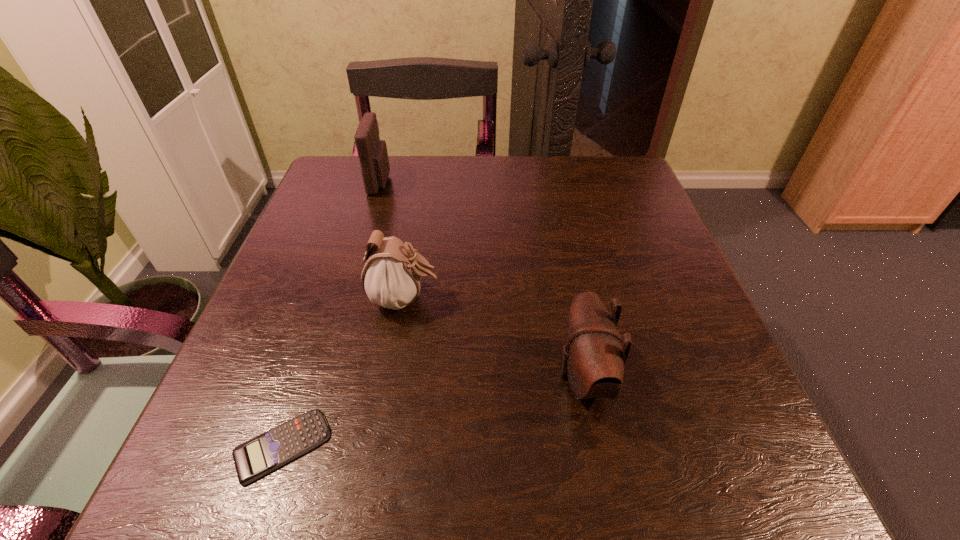
Locate an element on the screen. The width and height of the screenshot is (960, 540). free point at the near edge is located at coordinates (447, 441).

The width and height of the screenshot is (960, 540). Identify the location of vacant space at the left edge of the desktop. (344, 228).

This screenshot has width=960, height=540. Find the location of `vacant space at the right edge of the desktop`. vacant space at the right edge of the desktop is located at coordinates (621, 248).

In the image, there is a desktop. At what (x,y) coordinates should I click in order to perform the action: click on blank space at the far left corner. Please return your answer as a coordinate pair (x, y). Looking at the image, I should click on (324, 198).

Where is `vacant space at the near left corner`? vacant space at the near left corner is located at coordinates (x=197, y=488).

At what (x,y) coordinates should I click in order to perform the action: click on vacant region at the far right corner of the desktop. Please return your answer as a coordinate pair (x, y). Looking at the image, I should click on (615, 202).

Find the location of a particular element. free region at the near right corner of the desktop is located at coordinates (716, 442).

You are a GUI agent. You are given a task and a screenshot of the screen. Output one action in this format:
    pyautogui.click(x=<x>, y=<y>)
    Task: Click on the vacant region between the farthest object and the shortest object
    
    Given the screenshot: What is the action you would take?
    pyautogui.click(x=331, y=314)

The width and height of the screenshot is (960, 540). Identify the location of blank region between the nearest pouch and the shortest object. (433, 411).

Find the location of a particular element. The height and width of the screenshot is (540, 960). vacant area between the shortest object and the leftmost pouch is located at coordinates (331, 314).